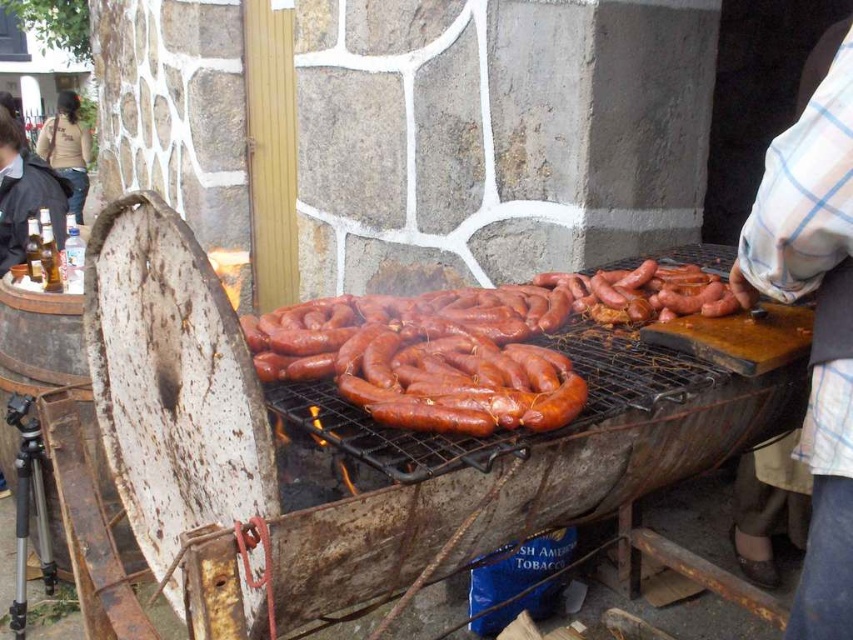
You are a photographer trying to capture a group photo of the people at the barbecue. You want to ensure both the white checkered shirt at upper right and the dark brown shirt at upper left are visible in the frame. Based on their positions, which shirt should you place on the left side of the photo to maintain their current spatial relationship?

To maintain their current spatial relationship, the dark brown shirt at upper left should be placed on the left side of the photo since the white checkered shirt at upper right is already positioned to the right of it.